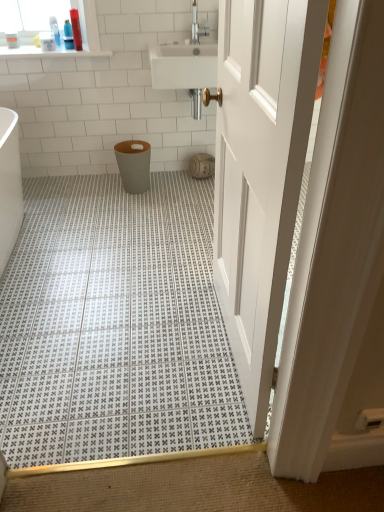
Question: Is brushed metal faucet at upper center completely or partially outside of matte beige toilet paper at center?

Choices:
 (A) no
 (B) yes

Answer: (B)

Question: Is brushed metal faucet at upper center not close to matte beige toilet paper at center?

Choices:
 (A) no
 (B) yes

Answer: (A)

Question: From a real-world perspective, is brushed metal faucet at upper center under matte beige toilet paper at center?

Choices:
 (A) no
 (B) yes

Answer: (A)

Question: Considering the relative sizes of brushed metal faucet at upper center and matte beige toilet paper at center in the image provided, is brushed metal faucet at upper center wider than matte beige toilet paper at center?

Choices:
 (A) yes
 (B) no

Answer: (B)

Question: Can you confirm if brushed metal faucet at upper center is taller than matte beige toilet paper at center?

Choices:
 (A) no
 (B) yes

Answer: (B)

Question: Are brushed metal faucet at upper center and matte beige toilet paper at center beside each other?

Choices:
 (A) no
 (B) yes

Answer: (A)

Question: Considering the relative positions of matte beige toilet paper at center and matte gray plastic toilet bowl at center in the image provided, is matte beige toilet paper at center in front of matte gray plastic toilet bowl at center?

Choices:
 (A) yes
 (B) no

Answer: (B)

Question: Is matte beige toilet paper at center far away from matte gray plastic toilet bowl at center?

Choices:
 (A) no
 (B) yes

Answer: (A)

Question: Does matte beige toilet paper at center have a lesser height compared to matte gray plastic toilet bowl at center?

Choices:
 (A) yes
 (B) no

Answer: (A)

Question: From a real-world perspective, is matte beige toilet paper at center under matte gray plastic toilet bowl at center?

Choices:
 (A) yes
 (B) no

Answer: (A)

Question: Does matte beige toilet paper at center have a greater width compared to matte gray plastic toilet bowl at center?

Choices:
 (A) no
 (B) yes

Answer: (A)

Question: Does matte beige toilet paper at center have a smaller size compared to matte gray plastic toilet bowl at center?

Choices:
 (A) yes
 (B) no

Answer: (A)

Question: Does matte beige toilet paper at center have a greater height compared to white plastic bottle at upper left, acting as the 3th toiletry starting from the right?

Choices:
 (A) yes
 (B) no

Answer: (A)